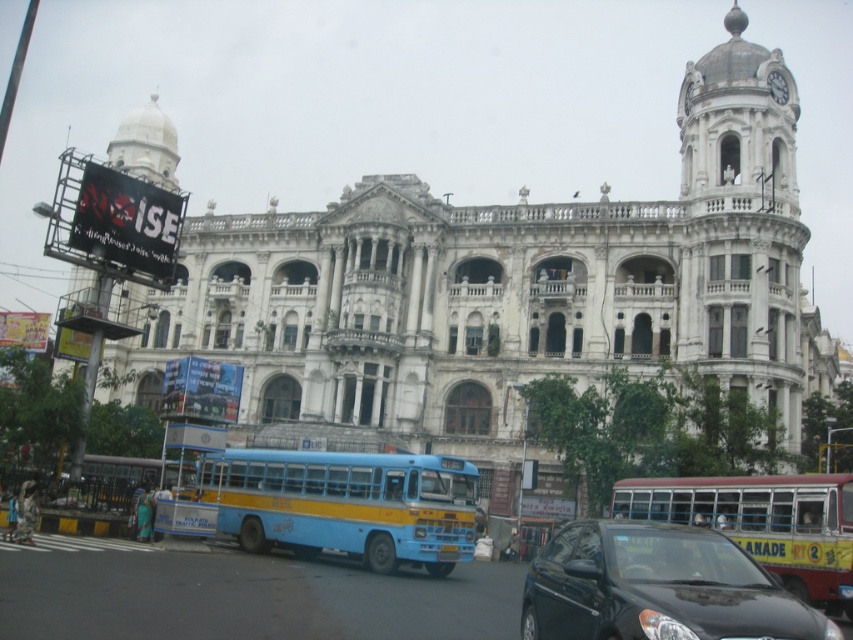
Question: Which of the following is the farthest from the observer?

Choices:
 (A) (689, 515)
 (B) (548, 600)
 (C) (85, 458)
 (D) (334, 492)

Answer: (C)

Question: Does blue matte bus at center have a greater width compared to blue/yellow painted bus at lower left?

Choices:
 (A) no
 (B) yes

Answer: (B)

Question: Considering the real-world distances, which object is farthest from the blue matte bus at center?

Choices:
 (A) blue/yellow painted bus at lower left
 (B) yellow painted bus at center
 (C) shiny black car at center

Answer: (B)

Question: Is shiny black car at center thinner than yellow painted bus at center?

Choices:
 (A) yes
 (B) no

Answer: (B)

Question: Does blue matte bus at center appear on the right side of yellow painted bus at center?

Choices:
 (A) yes
 (B) no

Answer: (B)

Question: Which of the following is the closest to the observer?

Choices:
 (A) (131, 490)
 (B) (293, 529)
 (C) (576, 524)

Answer: (C)